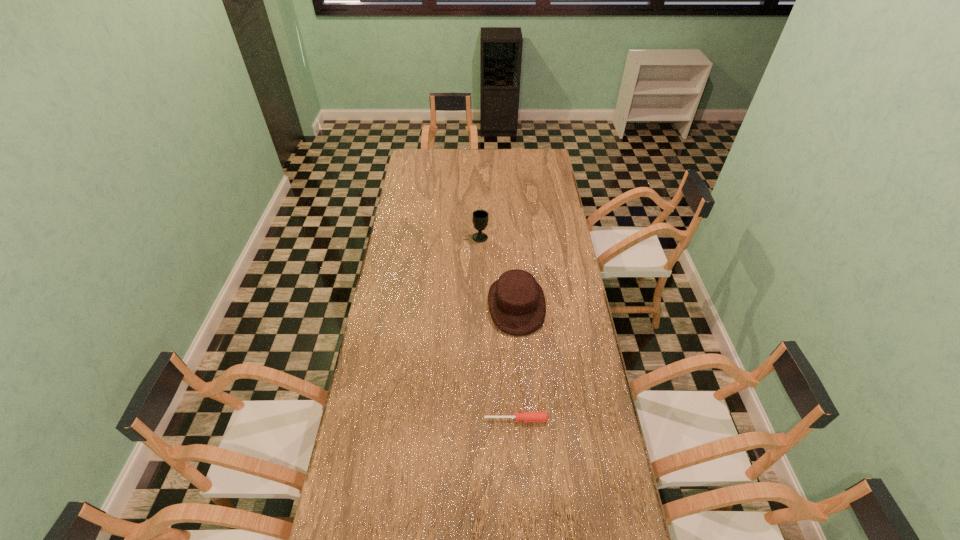
Locate an element on the screen. the farthest object is located at coordinates (480, 219).

Image resolution: width=960 pixels, height=540 pixels. Identify the location of chalice. (480, 219).

Find the location of a particular element. The image size is (960, 540). hat is located at coordinates (516, 301).

Identify the location of the second nearest object. The image size is (960, 540). (516, 301).

Locate an element on the screen. The image size is (960, 540). screwdriver is located at coordinates (525, 416).

Where is `the nearest object`? the nearest object is located at coordinates (525, 416).

Identify the location of vacant space located 0.110m on the right of the farthest object. This screenshot has height=540, width=960. tap(510, 237).

This screenshot has width=960, height=540. Identify the location of vacant space located on the back of the second nearest object. (514, 265).

This screenshot has height=540, width=960. What are the coordinates of `vacant point located on the front of the screwdriver` in the screenshot? It's located at (518, 451).

Locate an element on the screen. free space at the left edge is located at coordinates (427, 197).